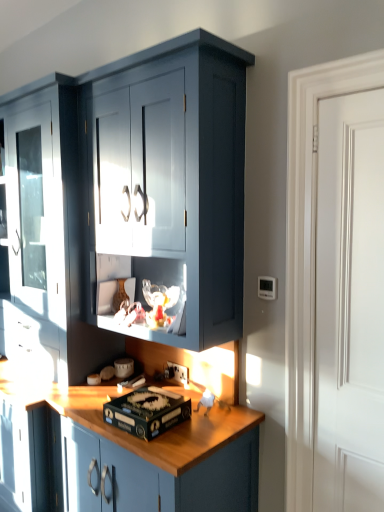
Question: Does black cardboard box at center have a smaller size compared to white plastic electric outlet at lower center?

Choices:
 (A) no
 (B) yes

Answer: (A)

Question: Considering the relative sizes of black cardboard box at center and white plastic electric outlet at lower center in the image provided, is black cardboard box at center taller than white plastic electric outlet at lower center?

Choices:
 (A) yes
 (B) no

Answer: (B)

Question: Is black cardboard box at center outside of white plastic electric outlet at lower center?

Choices:
 (A) no
 (B) yes

Answer: (B)

Question: Is black cardboard box at center with white plastic electric outlet at lower center?

Choices:
 (A) yes
 (B) no

Answer: (B)

Question: From a real-world perspective, is black cardboard box at center located higher than white plastic electric outlet at lower center?

Choices:
 (A) no
 (B) yes

Answer: (A)

Question: Would you say black cardboard box at center is a long distance from white plastic electric outlet at lower center?

Choices:
 (A) yes
 (B) no

Answer: (B)

Question: Considering the relative sizes of white smooth door at right and black cardboard box at center in the image provided, is white smooth door at right bigger than black cardboard box at center?

Choices:
 (A) yes
 (B) no

Answer: (A)

Question: Is white smooth door at right thinner than black cardboard box at center?

Choices:
 (A) yes
 (B) no

Answer: (A)

Question: Is white smooth door at right taller than black cardboard box at center?

Choices:
 (A) yes
 (B) no

Answer: (A)

Question: Can you confirm if white smooth door at right is positioned to the right of black cardboard box at center?

Choices:
 (A) no
 (B) yes

Answer: (B)

Question: Can you confirm if white smooth door at right is positioned to the left of black cardboard box at center?

Choices:
 (A) yes
 (B) no

Answer: (B)

Question: Does white smooth door at right lie in front of black cardboard box at center?

Choices:
 (A) yes
 (B) no

Answer: (A)

Question: Is white smooth door at right at the left side of matte dark blue cabinet at center?

Choices:
 (A) yes
 (B) no

Answer: (B)